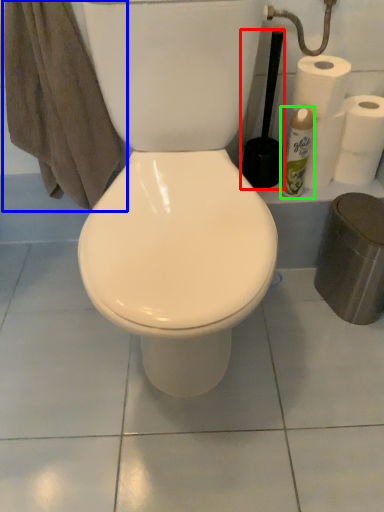
Question: Which object is the closest to the brush (highlighted by a red box)? Choose among these: bath towel (highlighted by a blue box) or cleaning product (highlighted by a green box).

Choices:
 (A) bath towel
 (B) cleaning product

Answer: (B)